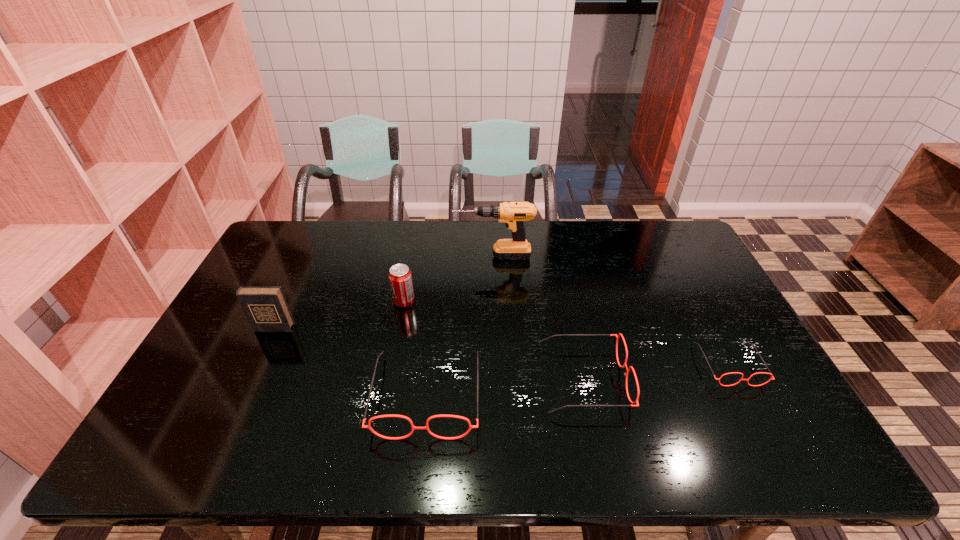
You are a GUI agent. You are given a task and a screenshot of the screen. Output one action in this format:
    pyautogui.click(x=<x>, y=<y>)
    Task: Click on the object that is at the right edge
    
    Given the screenshot: What is the action you would take?
    pyautogui.click(x=771, y=378)

Identify the location of vacant area at the far edge. (364, 252).

Where is `free space at the near edge of the desktop`? The image size is (960, 540). free space at the near edge of the desktop is located at coordinates (543, 415).

Find the location of `free space at the right edge`. free space at the right edge is located at coordinates (696, 340).

I want to click on free space at the far left corner of the desktop, so click(x=309, y=237).

Locate an element on the screen. vacant area that lies between the diary and the leftmost spectacles is located at coordinates (350, 361).

Image resolution: width=960 pixels, height=540 pixels. Find the location of `vacant point located between the rightmost object and the second spectacles from left to right`. vacant point located between the rightmost object and the second spectacles from left to right is located at coordinates (656, 372).

The height and width of the screenshot is (540, 960). Identify the location of empty space that is in between the farthest object and the leftmost object. (383, 292).

Where is `free point between the rightmost object and the soda`? The image size is (960, 540). free point between the rightmost object and the soda is located at coordinates (566, 333).

Locate an element on the screen. unoccupied position between the rightmost object and the soda is located at coordinates (566, 333).